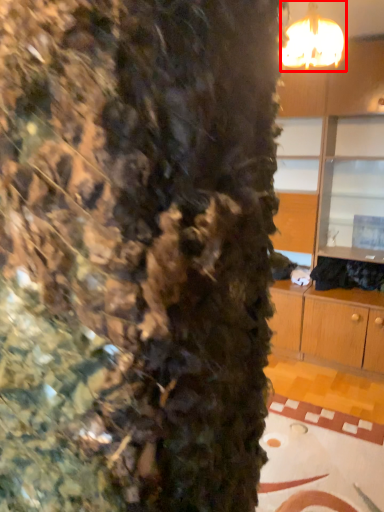
Question: From the image's perspective, considering the relative positions of lamp (annotated by the red box) and dresser in the image provided, where is lamp (annotated by the red box) located with respect to the staircase?

Choices:
 (A) below
 (B) above

Answer: (B)